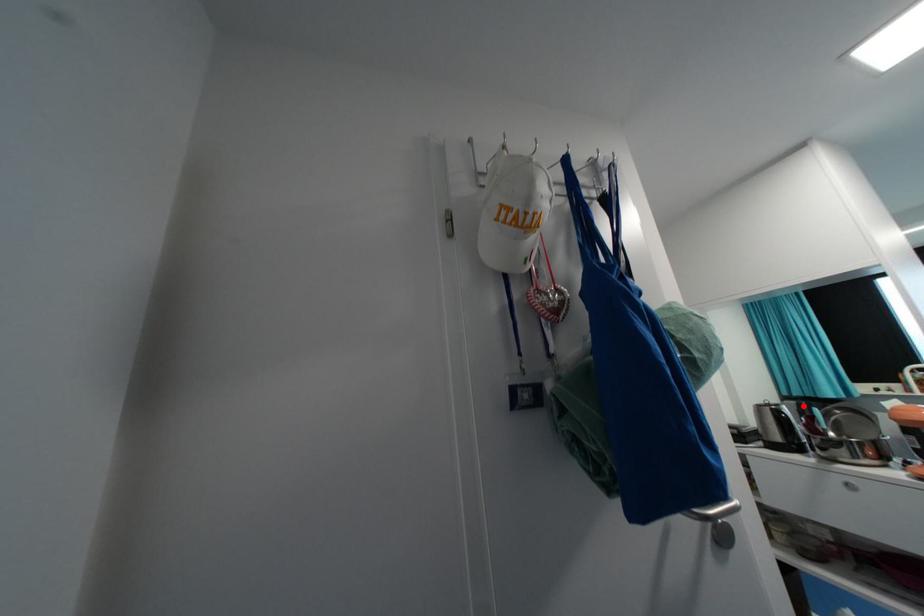
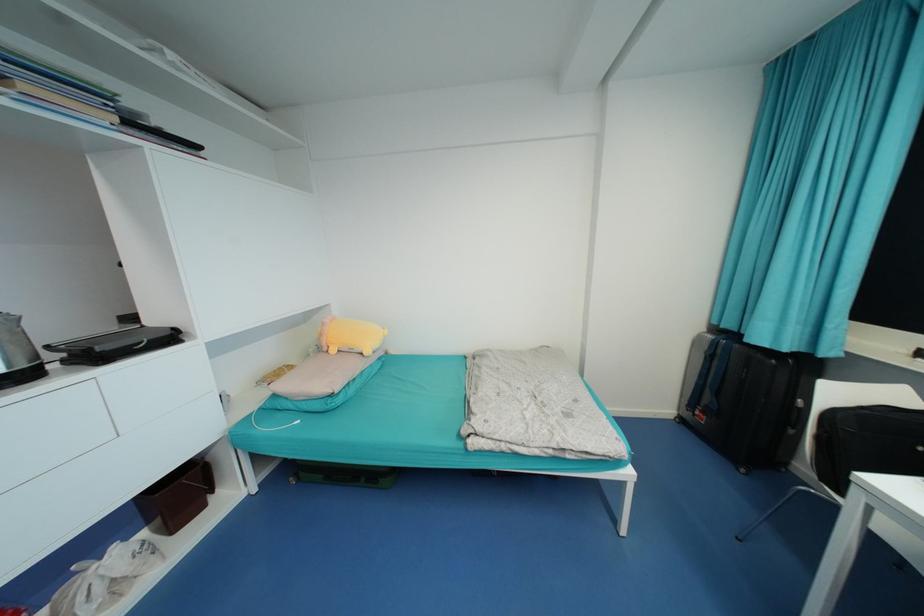
Question: A red point is marked in image1. In image2, is the corresponding 3D point closer to the camera or farther? Reply with the corresponding letter.

Choices:
 (A) The corresponding 3D point is closer.
 (B) The corresponding 3D point is farther.

Answer: (A)